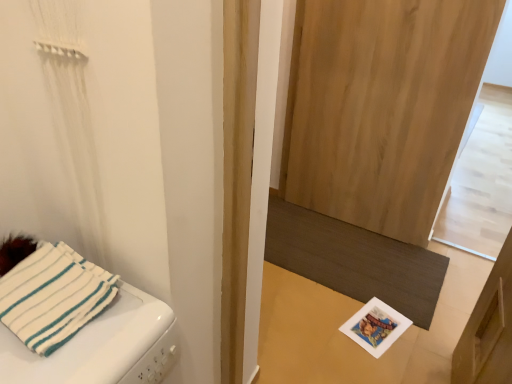
Image resolution: width=512 pixels, height=384 pixels. What are the coordinates of `free space in front of natural wood screen door at center` in the screenshot? It's located at (361, 329).